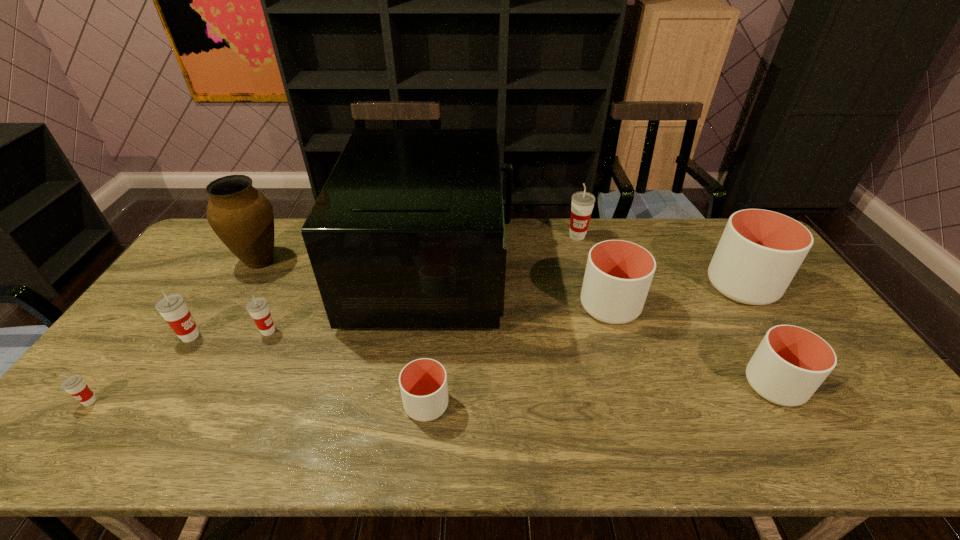
Identify the location of the second smallest red cup. This screenshot has width=960, height=540. (258, 308).

Where is `the third biggest white cup`? the third biggest white cup is located at coordinates (789, 365).

This screenshot has width=960, height=540. I want to click on the leftmost white cup, so click(423, 382).

Find the location of a particular element. The image size is (960, 540). the smallest white cup is located at coordinates (423, 382).

This screenshot has width=960, height=540. What are the coordinates of `the leftmost object` in the screenshot? It's located at (75, 385).

The width and height of the screenshot is (960, 540). Find the location of `the smallest red cup`. the smallest red cup is located at coordinates (75, 385).

Where is `vacant region located 0.150m on the front-facing side of the tallest object`? vacant region located 0.150m on the front-facing side of the tallest object is located at coordinates (557, 269).

Find the location of a particular element. This screenshot has width=960, height=540. vacant space located on the right of the brown urn is located at coordinates (335, 261).

Identify the location of vacant area situated 0.060m on the front of the biggest white cup. (768, 325).

The height and width of the screenshot is (540, 960). What are the coordinates of `vacant space located 0.110m on the side of the biggest red cup with the logo` in the screenshot? It's located at (585, 262).